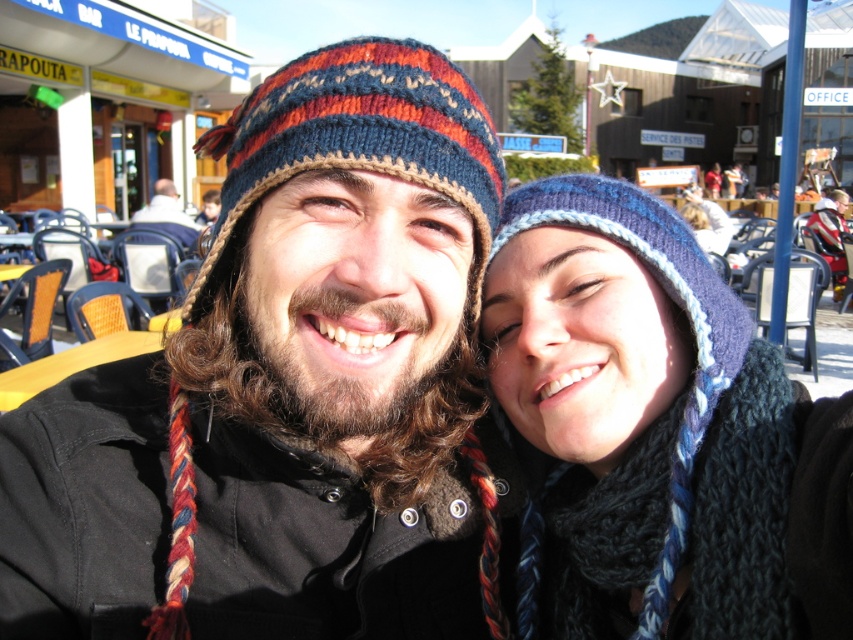
Question: Which point is closer to the camera?

Choices:
 (A) (486, 168)
 (B) (679, 593)

Answer: (A)

Question: Is blue knitted hat at center behind knitted woolen hat at center?

Choices:
 (A) no
 (B) yes

Answer: (A)

Question: Does blue knitted hat at center come in front of knitted woolen hat at center?

Choices:
 (A) yes
 (B) no

Answer: (A)

Question: Can you confirm if blue knitted hat at center is smaller than knitted woolen hat at center?

Choices:
 (A) yes
 (B) no

Answer: (B)